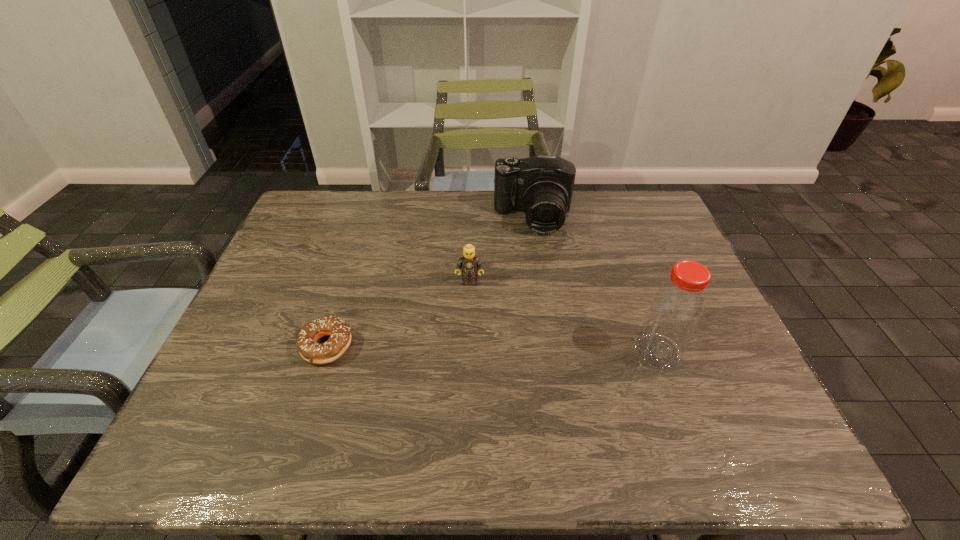
I want to click on free spot on the desktop that is between the shortest object and the rightmost object and is positioned on the lens of the farthest object, so click(531, 349).

Locate an element on the screen. This screenshot has width=960, height=540. free space on the desktop that is between the shortest object and the bottle and is positioned in front of the second object from left to right is located at coordinates (467, 349).